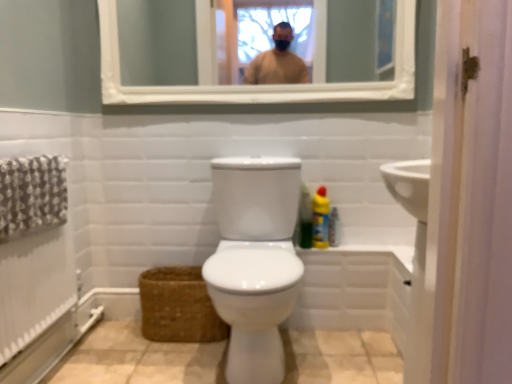
Question: Considering the relative sizes of green matte bottle at right, arranged as the first cleaning product when viewed from the left, and white wooden mirror at upper center in the image provided, is green matte bottle at right, arranged as the first cleaning product when viewed from the left, smaller than white wooden mirror at upper center?

Choices:
 (A) no
 (B) yes

Answer: (B)

Question: Is green matte bottle at right, arranged as the first cleaning product when viewed from the left, wider than white wooden mirror at upper center?

Choices:
 (A) yes
 (B) no

Answer: (A)

Question: From the image's perspective, is green matte bottle at right, arranged as the second cleaning product when viewed from the right, beneath white wooden mirror at upper center?

Choices:
 (A) no
 (B) yes

Answer: (B)

Question: Is green matte bottle at right, arranged as the first cleaning product when viewed from the left, outside white wooden mirror at upper center?

Choices:
 (A) no
 (B) yes

Answer: (B)

Question: Considering the relative sizes of green matte bottle at right, arranged as the second cleaning product when viewed from the right, and white wooden mirror at upper center in the image provided, is green matte bottle at right, arranged as the second cleaning product when viewed from the right, bigger than white wooden mirror at upper center?

Choices:
 (A) yes
 (B) no

Answer: (B)

Question: In the image, is yellow plastic bottle at right, which appears as the 2th cleaning product when viewed from the left, positioned in front of or behind brown woven basket at lower left?

Choices:
 (A) front
 (B) behind

Answer: (B)

Question: Choose the correct answer: Is yellow plastic bottle at right, the first cleaning product viewed from the right, inside brown woven basket at lower left or outside it?

Choices:
 (A) outside
 (B) inside

Answer: (A)

Question: From a real-world perspective, is yellow plastic bottle at right, the first cleaning product viewed from the right, above or below brown woven basket at lower left?

Choices:
 (A) above
 (B) below

Answer: (A)

Question: Considering the positions of yellow plastic bottle at right, the first cleaning product viewed from the right, and brown woven basket at lower left in the image, is yellow plastic bottle at right, the first cleaning product viewed from the right, bigger or smaller than brown woven basket at lower left?

Choices:
 (A) big
 (B) small

Answer: (B)

Question: From a real-world perspective, is translucent plastic spray bottle at right physically located above or below green matte bottle at right, arranged as the first cleaning product when viewed from the left?

Choices:
 (A) below
 (B) above

Answer: (A)

Question: Considering the positions of translucent plastic spray bottle at right and green matte bottle at right, arranged as the second cleaning product when viewed from the right, in the image, is translucent plastic spray bottle at right bigger or smaller than green matte bottle at right, arranged as the second cleaning product when viewed from the right,?

Choices:
 (A) big
 (B) small

Answer: (B)

Question: From the image's perspective, relative to green matte bottle at right, arranged as the first cleaning product when viewed from the left, is translucent plastic spray bottle at right above or below?

Choices:
 (A) below
 (B) above

Answer: (A)

Question: Do you think translucent plastic spray bottle at right is within green matte bottle at right, arranged as the first cleaning product when viewed from the left, or outside of it?

Choices:
 (A) inside
 (B) outside

Answer: (B)

Question: From the image's perspective, relative to white wooden mirror at upper center, is white glossy bidet at center above or below?

Choices:
 (A) below
 (B) above

Answer: (A)

Question: Is point (203, 273) positioned closer to the camera than point (124, 84)?

Choices:
 (A) closer
 (B) farther

Answer: (A)